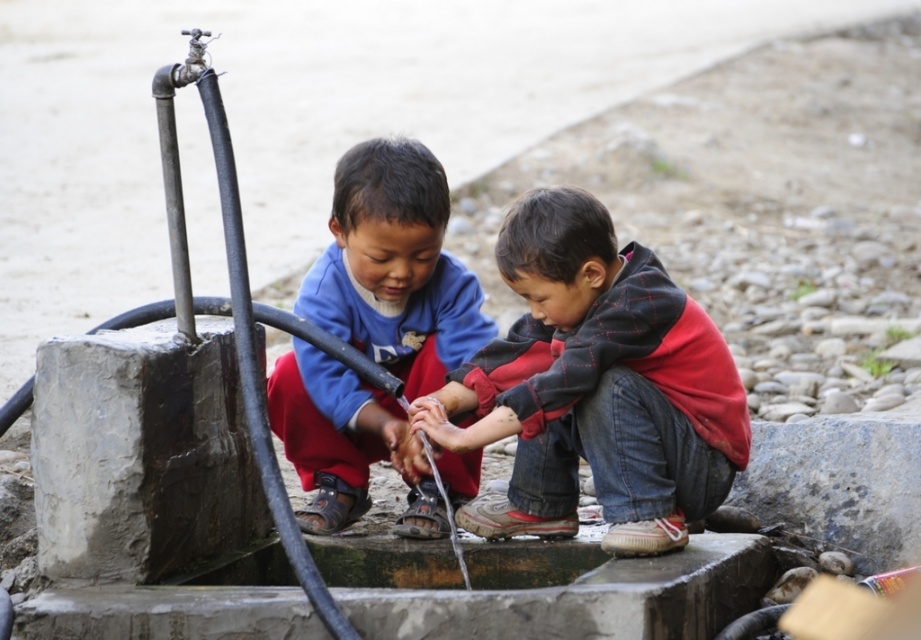
Question: Which object appears farthest from the camera in this image?

Choices:
 (A) blue fleece jacket at center
 (B) red plaid hoodie at center

Answer: (A)

Question: Does red plaid hoodie at center have a larger size compared to blue fleece jacket at center?

Choices:
 (A) no
 (B) yes

Answer: (A)

Question: From the image, what is the correct spatial relationship of red plaid hoodie at center in relation to blue fleece jacket at center?

Choices:
 (A) above
 (B) below

Answer: (B)

Question: Is red plaid hoodie at center closer to camera compared to blue fleece jacket at center?

Choices:
 (A) yes
 (B) no

Answer: (A)